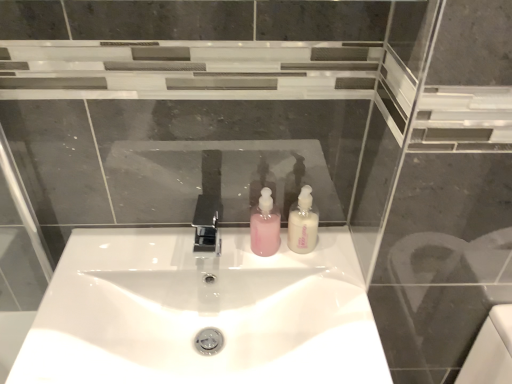
Question: Relative to pink matte soap dispenser at center, which appears as the first soap dispenser when viewed from the left, is white glossy sink at center in front or behind?

Choices:
 (A) front
 (B) behind

Answer: (A)

Question: From the image's perspective, is white glossy sink at center above or below pink matte soap dispenser at center, which appears as the first soap dispenser when viewed from the left?

Choices:
 (A) below
 (B) above

Answer: (A)

Question: Estimate the real-world distances between objects in this image. Which object is farther from the polished chrome tap at center?

Choices:
 (A) pink matte soap dispenser at center, which appears as the first soap dispenser when viewed from the left
 (B) white glossy soap dispenser at center, the 2th soap dispenser in the left-to-right sequence
 (C) white glossy sink at center

Answer: (C)

Question: Which is nearer to the pink matte soap dispenser at center, the second soap dispenser when ordered from right to left?

Choices:
 (A) white glossy soap dispenser at center, the first soap dispenser from the right
 (B) white glossy sink at center
 (C) polished chrome tap at center

Answer: (A)